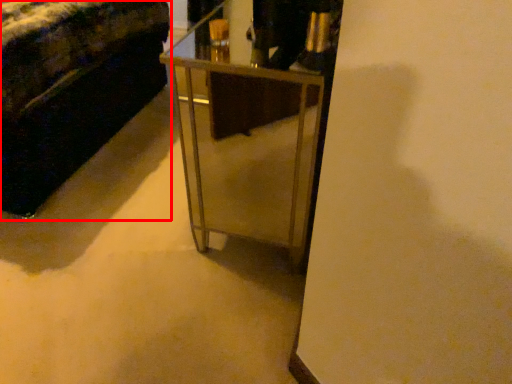
Question: From the image's perspective, where is furniture (annotated by the red box) located relative to table?

Choices:
 (A) below
 (B) above

Answer: (B)